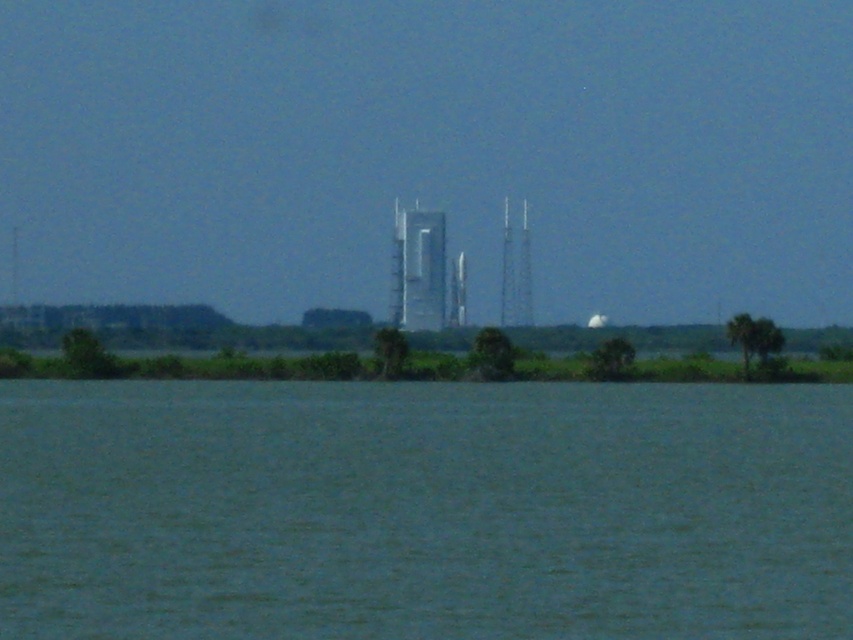
Measure the distance between blue water at center and metallic silver tower at center.

blue water at center is 194.66 feet from metallic silver tower at center.

Locate an element on the screen. The height and width of the screenshot is (640, 853). blue water at center is located at coordinates (424, 509).

Describe the element at coordinates (418, 269) in the screenshot. I see `metallic silver tower at center` at that location.

I want to click on metallic silver tower at center, so click(x=418, y=269).

The height and width of the screenshot is (640, 853). In order to click on metallic silver tower at center in this screenshot , I will do `click(418, 269)`.

Between smooth silver tower at center and shiny metallic rocket at center, which one is positioned lower?

shiny metallic rocket at center

What do you see at coordinates (515, 273) in the screenshot? This screenshot has width=853, height=640. I see `smooth silver tower at center` at bounding box center [515, 273].

You are a GUI agent. You are given a task and a screenshot of the screen. Output one action in this format:
    pyautogui.click(x=<x>, y=<y>)
    Task: Click on the smooth silver tower at center
    
    Given the screenshot: What is the action you would take?
    pyautogui.click(x=515, y=273)